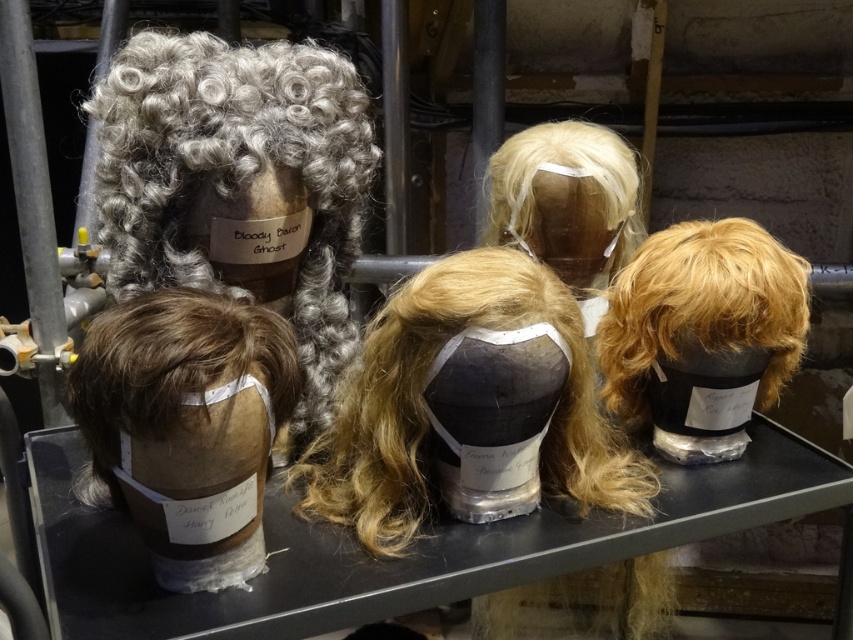
From the picture: Who is positioned more to the left, blonde synthetic wig at center or blonde synthetic wig at upper center?

blonde synthetic wig at center is more to the left.

Is point (379, 445) closer to viewer compared to point (622, 145)?

Yes.

Between point (471, 321) and point (595, 141), which one is positioned in front?

Point (471, 321) is more forward.

This screenshot has height=640, width=853. What are the coordinates of `blonde synthetic wig at center` in the screenshot? It's located at (424, 410).

Can you confirm if brown fuzzy wig at lower left is shorter than blonde synthetic wig at upper center?

Indeed, brown fuzzy wig at lower left has a lesser height compared to blonde synthetic wig at upper center.

Which is in front, point (73, 404) or point (550, 220)?

Positioned in front is point (73, 404).

Find the location of a particular element. The image size is (853, 640). brown fuzzy wig at lower left is located at coordinates pos(169,371).

Is curly gray wig at upper left smaller than blonde synthetic wig at center?

Incorrect, curly gray wig at upper left is not smaller in size than blonde synthetic wig at center.

Between point (126, 68) and point (368, 474), which one is positioned behind?

The point (368, 474) is behind.

Find the location of a particular element. The height and width of the screenshot is (640, 853). curly gray wig at upper left is located at coordinates (241, 186).